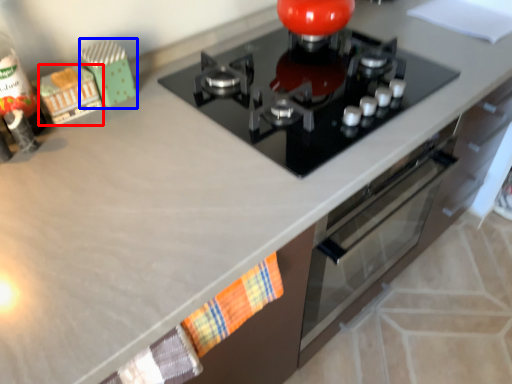
Question: Among these objects, which one is nearest to the camera, toy (highlighted by a red box) or toy (highlighted by a blue box)?

Choices:
 (A) toy
 (B) toy

Answer: (A)